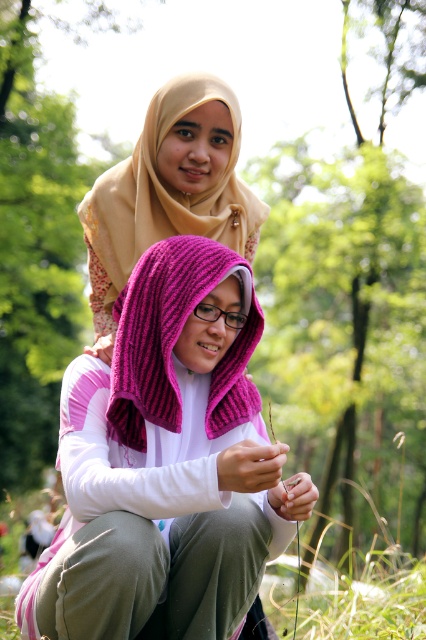
You are a photographer trying to capture both the fuchsia knitted shawl at lower center and the beige soft scarf at upper center in a single frame. Based on their positions, which object should you adjust your camera to focus on first to ensure both are in the frame?

The fuchsia knitted shawl at lower center is to the right of the beige soft scarf at upper center. To include both in the frame, focus on the beige soft scarf at upper center first since it is on the left side, then adjust the camera to include the fuchsia knitted shawl at lower center on the right.

You are a photographer trying to capture both the fuchsia knitted shawl at lower center and the beige soft scarf at upper center in a single frame. Based on their positions, which one would appear larger in the photo?

The fuchsia knitted shawl at lower center would appear larger in the photo because it is closer to the viewer than the beige soft scarf at upper center.

You are planning to wear one of these two scarves for a hike. The fuchsia knitted shawl at lower center and the beige soft scarf at upper center are both available. Considering their lengths, which one would be more suitable for a longer hike where you need a scarf that can be wrapped around your neck multiple times?

The beige soft scarf at upper center is longer than the fuchsia knitted shawl at lower center, so it would be more suitable for a longer hike where you need a scarf that can be wrapped around your neck multiple times.